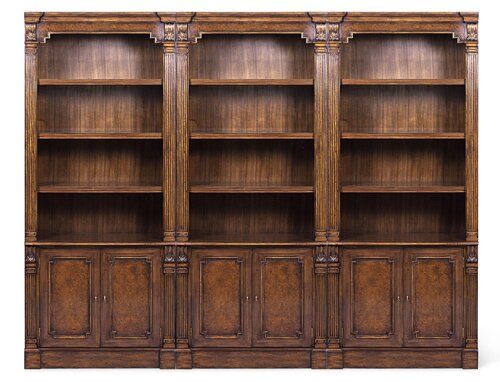
Where is `doors on cabinet`? This screenshot has width=500, height=382. doors on cabinet is located at coordinates (68, 320), (121, 315), (208, 316), (272, 316), (432, 307), (374, 306).